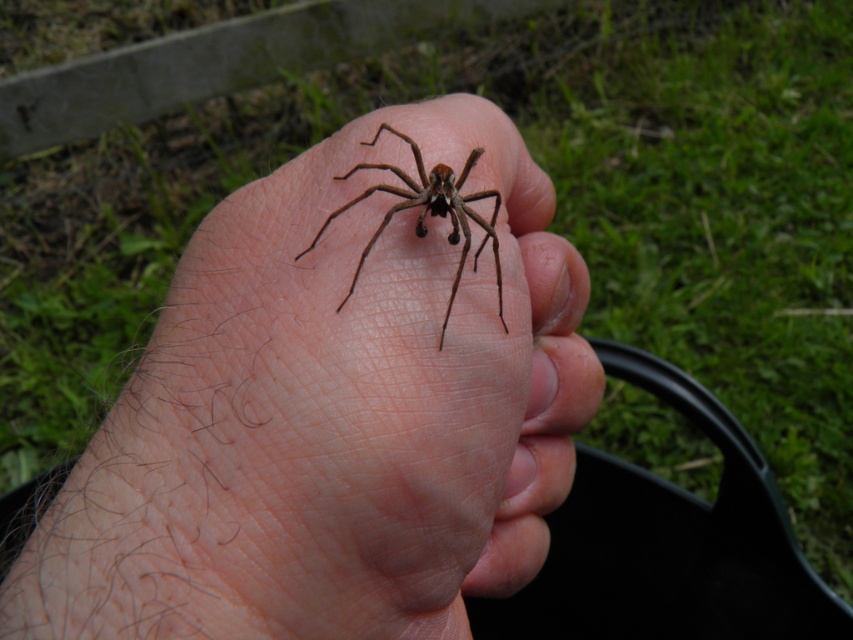
You are a photographer taking a closeup shot of a human foot. You want to ensure the brown hairy spider at center is centered in your photo. According to the coordinates provided, is the spider already centered?

The brown hairy spider at center is located at coordinates point (329,413), which means it is not perfectly centered since the center point would be at (426,320). To center it, you would need to adjust the camera position to align the spider with the central coordinates.

You are standing in an outdoor area with grass and vegetation. You see two points marked on the ground. The first point is at coordinate point [157,484] and the second is at point [381,228]. If you were to walk from the second point to the first point, which direction would you be moving relative to the two points?

Moving from point [381,228] to point [157,484], you would be moving forward since point [157,484] is in front of point [381,228].